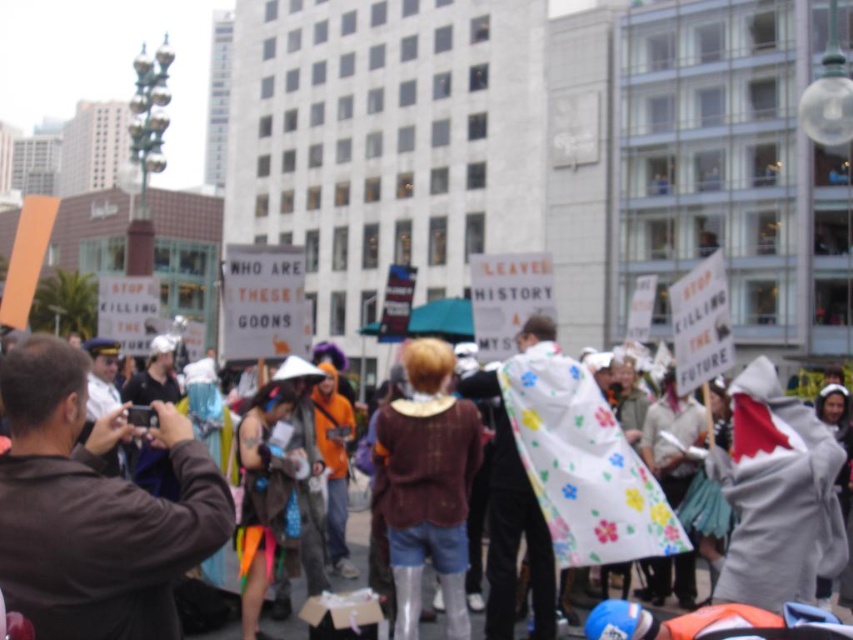
Question: Considering the relative positions of brown leather jacket at left and brown leather jacket at center in the image provided, where is brown leather jacket at left located with respect to brown leather jacket at center?

Choices:
 (A) right
 (B) left

Answer: (A)

Question: Among these objects, which one is nearest to the camera?

Choices:
 (A) brown leather jacket at center
 (B) brown leather jacket at left

Answer: (B)

Question: Does brown leather jacket at left appear on the right side of brown leather jacket at center?

Choices:
 (A) no
 (B) yes

Answer: (B)

Question: Is brown leather jacket at left positioned at the back of brown leather jacket at center?

Choices:
 (A) yes
 (B) no

Answer: (B)